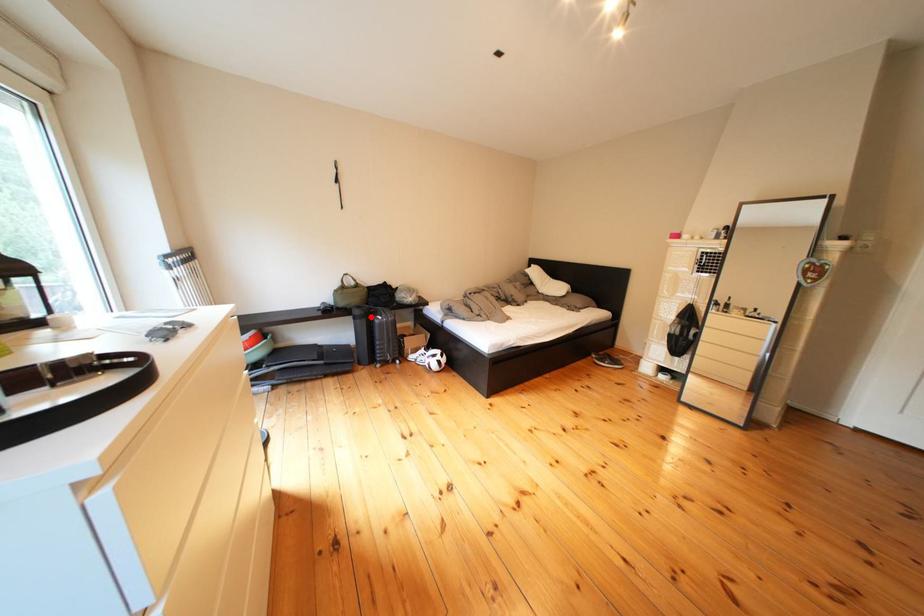
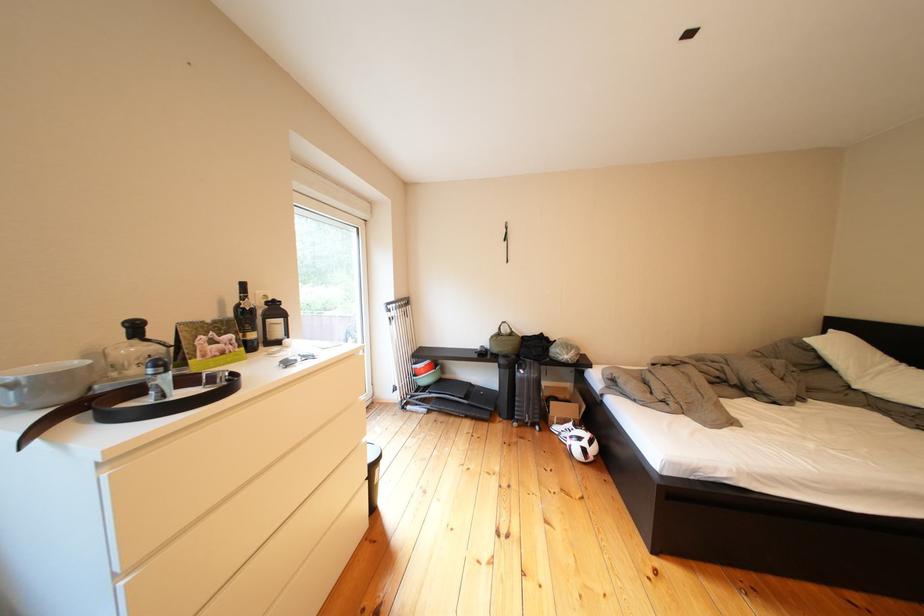
Where in the second image is the point corresponding to the highlighted location from the first image?

(516, 366)